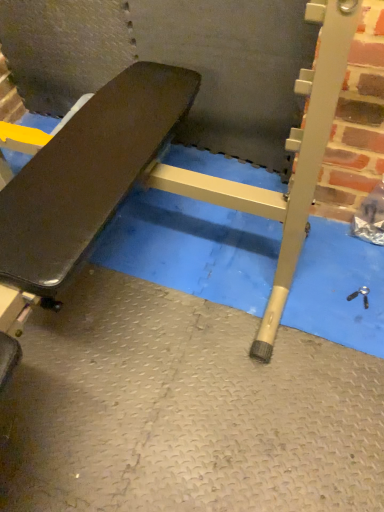
Question: Should I look upward or downward to see metallic silver screw at lower right?

Choices:
 (A) down
 (B) up

Answer: (A)